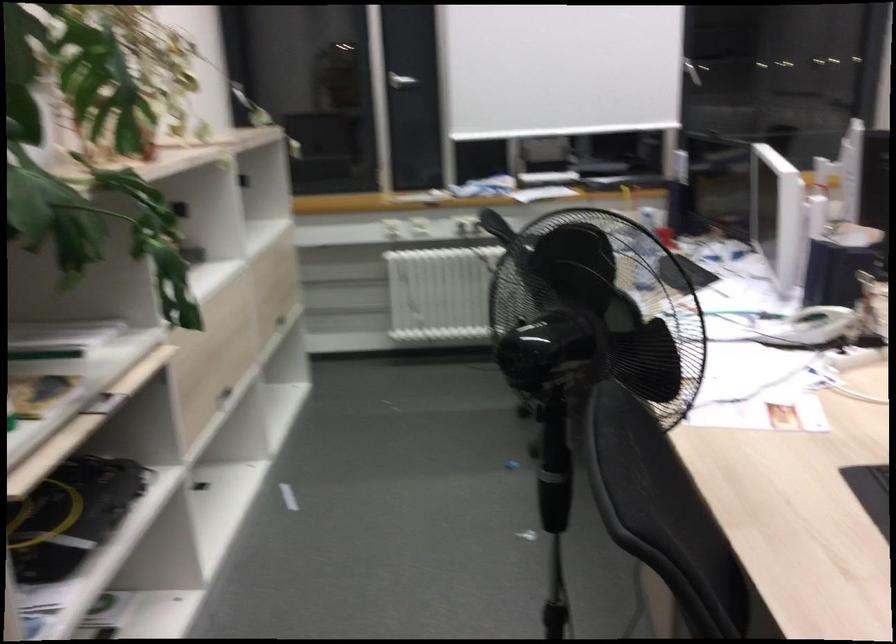
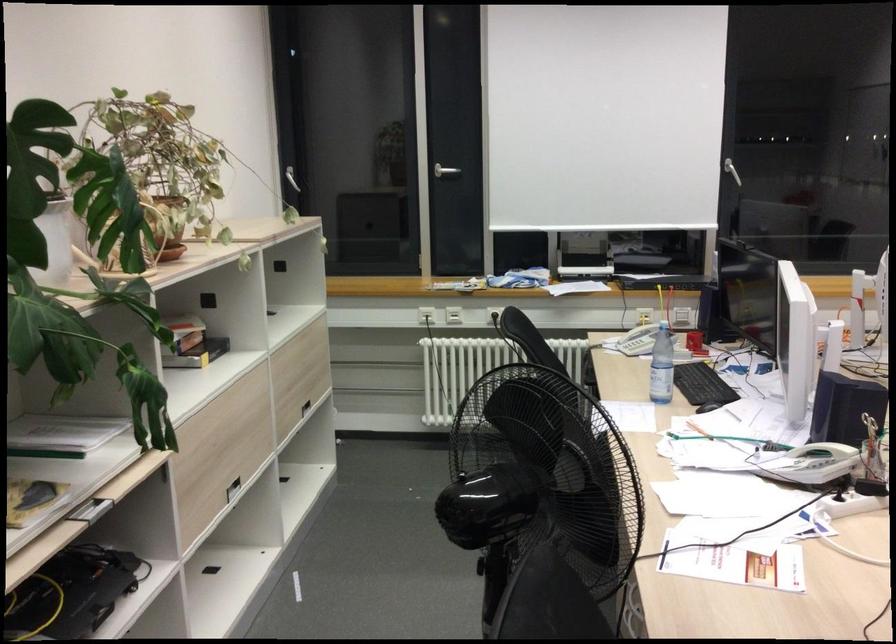
The point at (398, 80) is marked in the first image. Where is the corresponding point in the second image?

(445, 171)